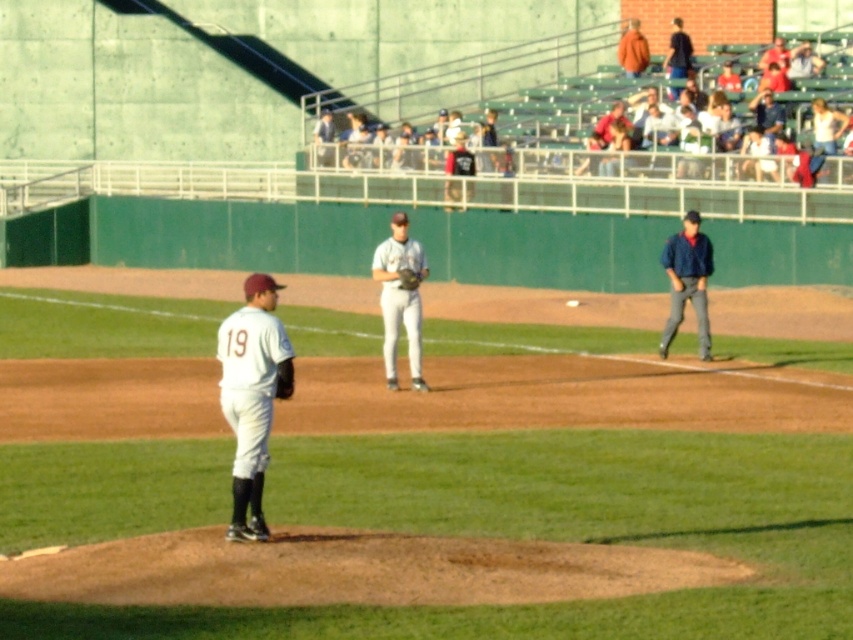
Question: Is white jersey at center above orange jacket at upper right?

Choices:
 (A) yes
 (B) no

Answer: (B)

Question: Which of these objects is positioned closest to the dark blue jacket at upper right?

Choices:
 (A) blue denim jacket at right
 (B) matte gray uniform at center
 (C) dark gray leather glove at center
 (D) white uniform at center

Answer: (B)

Question: Which is nearer to the orange jacket at upper right?

Choices:
 (A) light blue jersey at upper center
 (B) dark gray leather glove at center

Answer: (A)

Question: Can you confirm if white uniformed players at upper center is positioned to the right of dark blue jacket at upper right?

Choices:
 (A) no
 (B) yes

Answer: (A)

Question: Which point is farther to the camera?

Choices:
 (A) (764, 56)
 (B) (389, 380)
 (C) (401, 284)
 (D) (688, 218)

Answer: (A)

Question: Does blue denim jacket at right have a smaller size compared to dark gray leather glove at center?

Choices:
 (A) yes
 (B) no

Answer: (B)